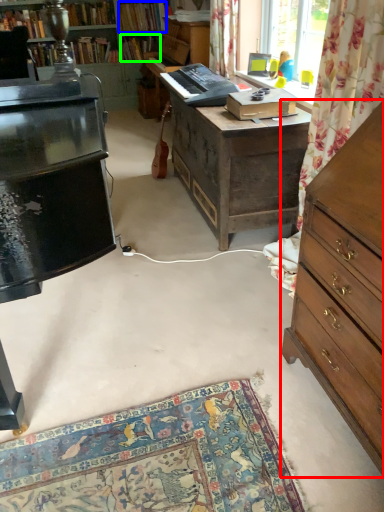
Question: Estimate the real-world distances between objects in this image. Which object is closer to chest of drawers (highlighted by a red box), book (highlighted by a blue box) or book (highlighted by a green box)?

Choices:
 (A) book
 (B) book

Answer: (A)